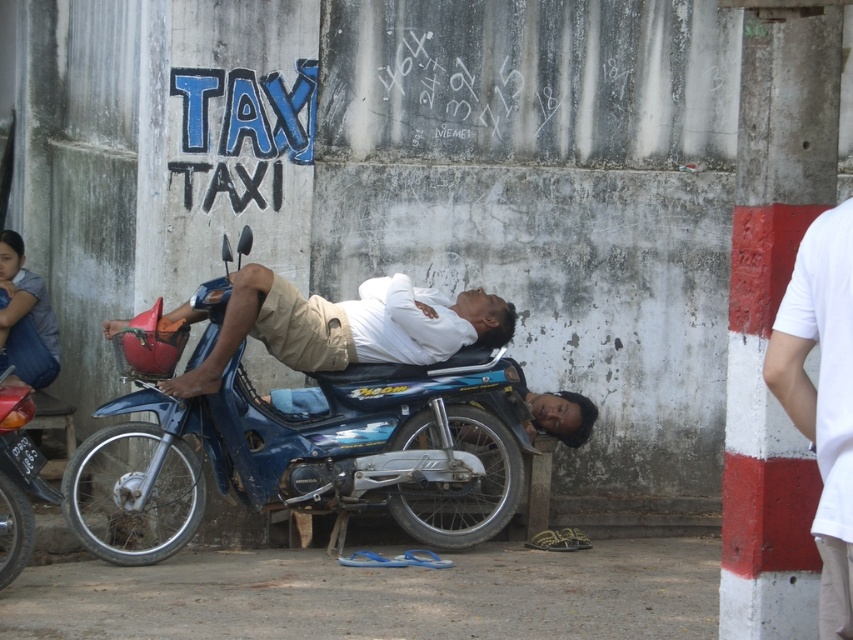
You are a pedestrian standing on the sidewalk and see the blue metallic motorcycle at center. There is a fire hydrant 7.63 meters away from it. Can you safely walk around the motorcycle without getting too close to the hydrant?

The blue metallic motorcycle at center and the fire hydrant are 7.63 meters apart. Since the recommended safe distance from a fire hydrant is typically 1.5 meters, you can safely walk around the motorcycle as the distance between them allows enough space.

You are a delivery person who needs to load a package onto the blue metallic motorcycle at center. The package is as wide as the white cotton shirt at right. Will the package fit on the motorcycle?

The blue metallic motorcycle at center is wider than the white cotton shirt at right, so the package, being as wide as the shirt, will fit on the motorcycle.